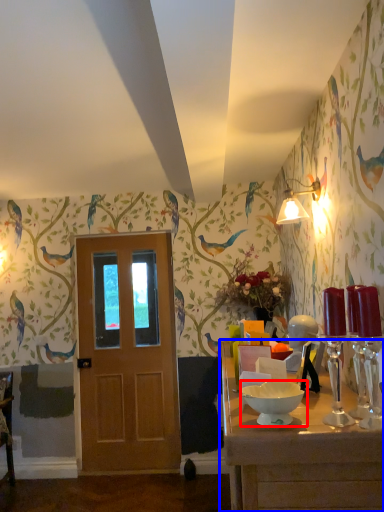
Question: Which object appears closest to the camera in this image, bowl (highlighted by a red box) or table (highlighted by a blue box)?

Choices:
 (A) bowl
 (B) table

Answer: (B)